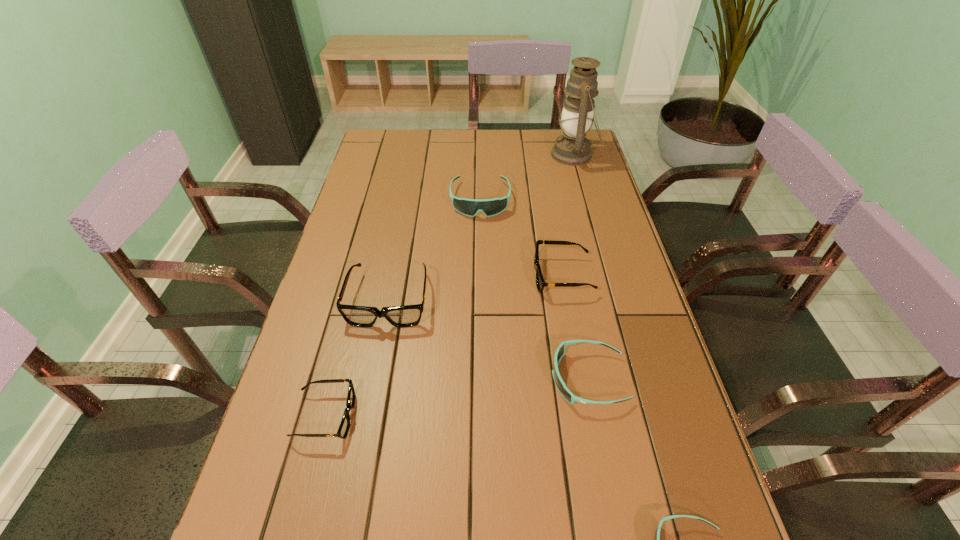
This screenshot has width=960, height=540. In order to click on free space located 0.370m on the front-facing side of the fifth object from right to left in this screenshot , I will do pos(480,311).

At what (x,y) coordinates should I click in order to perform the action: click on vacant space located 0.200m on the front-facing side of the rightmost black sunglasses. Please return your answer as a coordinate pair (x, y). Looking at the image, I should click on (460, 276).

The width and height of the screenshot is (960, 540). What are the coordinates of `vacant area situated 0.200m on the front-facing side of the rightmost black sunglasses` in the screenshot? It's located at (460, 276).

Image resolution: width=960 pixels, height=540 pixels. Find the location of `free space located on the front-facing side of the rightmost black sunglasses`. free space located on the front-facing side of the rightmost black sunglasses is located at coordinates (464, 276).

Where is `free space located 0.310m on the front-facing side of the second farthest cyan sunglasses`? free space located 0.310m on the front-facing side of the second farthest cyan sunglasses is located at coordinates (412, 379).

What are the coordinates of `vacant point located on the front-facing side of the second farthest cyan sunglasses` in the screenshot? It's located at (420, 379).

The height and width of the screenshot is (540, 960). I want to click on free space located 0.180m on the front-facing side of the second farthest cyan sunglasses, so click(470, 379).

You are a GUI agent. You are given a task and a screenshot of the screen. Output one action in this format:
    pyautogui.click(x=<x>, y=<y>)
    Task: Click on the vacant space situated 0.080m on the front-facing side of the smallest black sunglasses
    
    Given the screenshot: What is the action you would take?
    pyautogui.click(x=393, y=416)

Identify the location of object present at the far edge. The width and height of the screenshot is (960, 540). (572, 148).

This screenshot has width=960, height=540. Find the location of `oil lamp present at the right edge`. oil lamp present at the right edge is located at coordinates (572, 148).